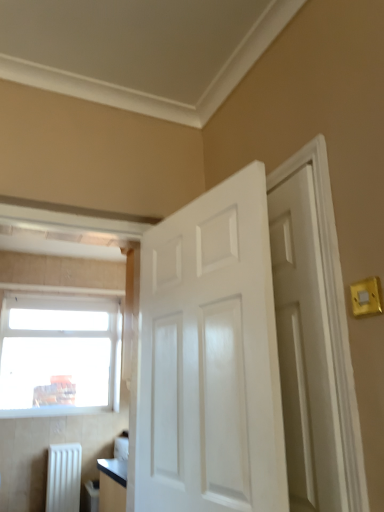
I want to click on white matte radiator at lower left, so [63, 478].

In the scene shown: Is white glossy door at center, positioned as the 1th door in left-to-right order, taller or shorter than transparent glass window at upper left?

Clearly, white glossy door at center, positioned as the 1th door in left-to-right order, is taller compared to transparent glass window at upper left.

Between white glossy door at center, positioned as the 1th door in left-to-right order, and transparent glass window at upper left, which one has larger width?

white glossy door at center, positioned as the 1th door in left-to-right order.

Based on the photo, is white glossy door at center, positioned as the 1th door in left-to-right order, far from transparent glass window at upper left?

Yes, white glossy door at center, positioned as the 1th door in left-to-right order, and transparent glass window at upper left are located far from each other.

Is white glossy door at center, positioned as the 1th door in left-to-right order, aimed at transparent glass window at upper left?

No, white glossy door at center, positioned as the 1th door in left-to-right order, does not turn towards transparent glass window at upper left.

Can you tell me how much white glossy door at center, positioned as the 1th door in left-to-right order, and yellow plastic light switch at upper right differ in facing direction?

white glossy door at center, positioned as the 1th door in left-to-right order, and yellow plastic light switch at upper right are facing 7.95 degrees away from each other.

Is white glossy door at center, positioned as the 1th door in left-to-right order, inside the boundaries of yellow plastic light switch at upper right, or outside?

white glossy door at center, positioned as the 1th door in left-to-right order, exists outside the volume of yellow plastic light switch at upper right.

From a real-world perspective, is white glossy door at center, the 2th door positioned from the right, physically below yellow plastic light switch at upper right?

Yes, from a real-world perspective, white glossy door at center, the 2th door positioned from the right, is below yellow plastic light switch at upper right.

Is white glossy door at center, the 2th door positioned from the right, thinner than yellow plastic light switch at upper right?

In fact, white glossy door at center, the 2th door positioned from the right, might be wider than yellow plastic light switch at upper right.

Is point (299, 446) behind point (51, 492)?

That is False.

From a real-world perspective, is white glossy door at right, which is counted as the 2th door, starting from the left, positioned over white matte radiator at lower left based on gravity?

Yes, from a real-world perspective, white glossy door at right, which is counted as the 2th door, starting from the left, is over white matte radiator at lower left

What's the angular difference between white glossy door at right, placed as the first door when sorted from right to left, and white matte radiator at lower left's facing directions?

white glossy door at right, placed as the first door when sorted from right to left, and white matte radiator at lower left are facing 93.2 degrees away from each other.

Based on the photo, can you confirm if white glossy door at right, which is counted as the 2th door, starting from the left, is bigger than white matte radiator at lower left?

Incorrect, white glossy door at right, which is counted as the 2th door, starting from the left, is not larger than white matte radiator at lower left.

Can you confirm if yellow plastic light switch at upper right is positioned to the right of white glossy door at center, positioned as the 1th door in left-to-right order?

Indeed, yellow plastic light switch at upper right is positioned on the right side of white glossy door at center, positioned as the 1th door in left-to-right order.

Could you tell me if yellow plastic light switch at upper right is facing white glossy door at center, positioned as the 1th door in left-to-right order?

No, yellow plastic light switch at upper right is not oriented towards white glossy door at center, positioned as the 1th door in left-to-right order.

From a real-world perspective, is yellow plastic light switch at upper right physically below white glossy door at center, positioned as the 1th door in left-to-right order?

No, from a real-world perspective, yellow plastic light switch at upper right is not beneath white glossy door at center, positioned as the 1th door in left-to-right order.

Can you tell me how much yellow plastic light switch at upper right and white glossy door at center, positioned as the 1th door in left-to-right order, differ in facing direction?

The angular difference between yellow plastic light switch at upper right and white glossy door at center, positioned as the 1th door in left-to-right order, is 7.95 degrees.

From the image's perspective, relative to white matte radiator at lower left, is white glossy door at center, positioned as the 1th door in left-to-right order, above or below?

white glossy door at center, positioned as the 1th door in left-to-right order, is above white matte radiator at lower left.

In terms of size, does white glossy door at center, positioned as the 1th door in left-to-right order, appear bigger or smaller than white matte radiator at lower left?

Clearly, white glossy door at center, positioned as the 1th door in left-to-right order, is larger in size than white matte radiator at lower left.

Considering their positions, is white glossy door at center, the 2th door positioned from the right, located in front of or behind white matte radiator at lower left?

white glossy door at center, the 2th door positioned from the right, is positioned closer to the viewer than white matte radiator at lower left.

Is white glossy door at center, positioned as the 1th door in left-to-right order, in front of or behind white glossy door at right, which is counted as the 2th door, starting from the left, in the image?

Visually, white glossy door at center, positioned as the 1th door in left-to-right order, is located in front of white glossy door at right, which is counted as the 2th door, starting from the left.

Is white glossy door at center, the 2th door positioned from the right, facing towards white glossy door at right, which is counted as the 2th door, starting from the left?

No, white glossy door at center, the 2th door positioned from the right, is not aimed at white glossy door at right, which is counted as the 2th door, starting from the left.

Is point (249, 186) positioned behind point (325, 470)?

Yes, point (249, 186) is behind point (325, 470).

Does white glossy door at center, positioned as the 1th door in left-to-right order, have a smaller size compared to white glossy door at right, which is counted as the 2th door, starting from the left?

Incorrect, white glossy door at center, positioned as the 1th door in left-to-right order, is not smaller in size than white glossy door at right, which is counted as the 2th door, starting from the left.

How many degrees apart are the facing directions of transparent glass window at upper left and white glossy door at right, which is counted as the 2th door, starting from the left?

The facing directions of transparent glass window at upper left and white glossy door at right, which is counted as the 2th door, starting from the left, are 90.6 degrees apart.

In terms of size, does transparent glass window at upper left appear bigger or smaller than white glossy door at right, placed as the first door when sorted from right to left?

transparent glass window at upper left is bigger than white glossy door at right, placed as the first door when sorted from right to left.

Is transparent glass window at upper left facing away from white glossy door at right, which is counted as the 2th door, starting from the left?

transparent glass window at upper left does not have its back to white glossy door at right, which is counted as the 2th door, starting from the left.

Considering the relative sizes of transparent glass window at upper left and white glossy door at right, placed as the first door when sorted from right to left, in the image provided, is transparent glass window at upper left wider than white glossy door at right, placed as the first door when sorted from right to left,?

Incorrect, the width of transparent glass window at upper left does not surpass that of white glossy door at right, placed as the first door when sorted from right to left.

The height and width of the screenshot is (512, 384). Identify the location of the 1st door positioned above the transparent glass window at upper left (from the image's perspective). (210, 358).

From the image's perspective, which door is the 2nd one below the yellow plastic light switch at upper right? Please provide its 2D coordinates.

[(210, 358)]

Which object lies nearer to the anchor point white matte radiator at lower left, yellow plastic light switch at upper right or transparent glass window at upper left?

transparent glass window at upper left lies closer to white matte radiator at lower left than the other object.

Considering their positions, is white glossy door at center, the 2th door positioned from the right, positioned closer to yellow plastic light switch at upper right than white glossy door at right, which is counted as the 2th door, starting from the left?

white glossy door at right, which is counted as the 2th door, starting from the left, is closer to yellow plastic light switch at upper right.

Looking at this image, from the image, which object appears to be farther from white glossy door at center, the 2th door positioned from the right, white glossy door at right, which is counted as the 2th door, starting from the left, or yellow plastic light switch at upper right?

yellow plastic light switch at upper right lies further to white glossy door at center, the 2th door positioned from the right, than the other object.

Which object lies further to the anchor point transparent glass window at upper left, white matte radiator at lower left or white glossy door at center, positioned as the 1th door in left-to-right order?

Based on the image, white glossy door at center, positioned as the 1th door in left-to-right order, appears to be further to transparent glass window at upper left.

Based on their spatial positions, is white matte radiator at lower left or yellow plastic light switch at upper right further from white glossy door at center, positioned as the 1th door in left-to-right order?

Based on the image, white matte radiator at lower left appears to be further to white glossy door at center, positioned as the 1th door in left-to-right order.

Looking at the image, which one is located closer to white glossy door at right, placed as the first door when sorted from right to left, yellow plastic light switch at upper right or white glossy door at center, positioned as the 1th door in left-to-right order?

The object closer to white glossy door at right, placed as the first door when sorted from right to left, is white glossy door at center, positioned as the 1th door in left-to-right order.

Estimate the real-world distances between objects in this image. Which object is closer to white glossy door at center, the 2th door positioned from the right, white glossy door at right, which is counted as the 2th door, starting from the left, or transparent glass window at upper left?

white glossy door at right, which is counted as the 2th door, starting from the left.

When comparing their distances from white glossy door at right, which is counted as the 2th door, starting from the left, does white matte radiator at lower left or transparent glass window at upper left seem further?

The object further to white glossy door at right, which is counted as the 2th door, starting from the left, is transparent glass window at upper left.

This screenshot has width=384, height=512. Find the location of `door between white glossy door at center, positioned as the 1th door in left-to-right order, and white matte radiator at lower left, along the z-axis`. door between white glossy door at center, positioned as the 1th door in left-to-right order, and white matte radiator at lower left, along the z-axis is located at coordinates (305, 350).

Find the location of `door between white glossy door at center, positioned as the 1th door in left-to-right order, and transparent glass window at upper left from front to back`. door between white glossy door at center, positioned as the 1th door in left-to-right order, and transparent glass window at upper left from front to back is located at coordinates (305, 350).

Identify the location of light switch between white glossy door at center, positioned as the 1th door in left-to-right order, and transparent glass window at upper left in the front-back direction. (366, 297).

The height and width of the screenshot is (512, 384). What are the coordinates of `light switch between white glossy door at center, positioned as the 1th door in left-to-right order, and white matte radiator at lower left, along the z-axis` in the screenshot? It's located at (366, 297).